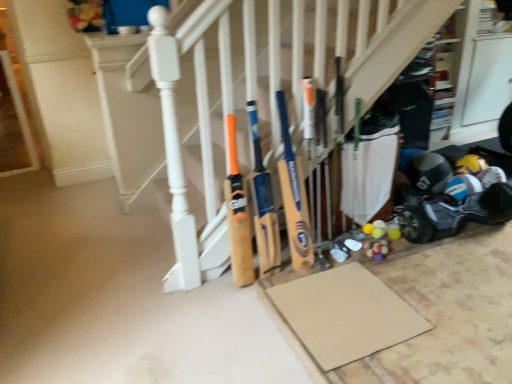
Measure the distance between yellow wood bat at center, which is the second baseball bat from left to right, and camera.

A distance of 1.83 meters exists between yellow wood bat at center, which is the second baseball bat from left to right, and camera.

What do you see at coordinates (327, 54) in the screenshot? Image resolution: width=512 pixels, height=384 pixels. I see `wooden bats at center` at bounding box center [327, 54].

Locate an element on the screen. wooden bats at center is located at coordinates (327, 54).

Find the location of a particular element. yellow wood bat at center, which is the second baseball bat from left to right is located at coordinates (294, 197).

Who is shorter, yellow wood bat at center, which is the second baseball bat from left to right, or wooden bat at center, the 1th baseball bat from the left?

With less height is wooden bat at center, the 1th baseball bat from the left.

Could you tell me if yellow wood bat at center, which is the 1th baseball bat from right to left, is turned towards wooden bat at center, the 1th baseball bat from the left?

No, yellow wood bat at center, which is the 1th baseball bat from right to left, is not turned towards wooden bat at center, the 1th baseball bat from the left.

Consider the image. Which object is positioned more to the left, yellow wood bat at center, which is the 1th baseball bat from right to left, or wooden bat at center, the second baseball bat positioned from the right?

wooden bat at center, the second baseball bat positioned from the right.

Which of these two, yellow wood bat at center, which is the 1th baseball bat from right to left, or wooden bat at center, the 1th baseball bat from the left, is smaller?

wooden bat at center, the 1th baseball bat from the left, is smaller.

Is blue plastic baby carriage at lower right inside or outside of wooden bats at center?

blue plastic baby carriage at lower right lies outside wooden bats at center.

Does blue plastic baby carriage at lower right have a greater height compared to wooden bats at center?

In fact, blue plastic baby carriage at lower right may be shorter than wooden bats at center.

Looking at this image, can you confirm if blue plastic baby carriage at lower right is bigger than wooden bats at center?

Incorrect, blue plastic baby carriage at lower right is not larger than wooden bats at center.

Which is in front, point (419, 204) or point (179, 241)?

The point (179, 241) is in front.

Is wooden bats at center positioned far away from blue plastic baby carriage at lower right?

wooden bats at center is positioned a significant distance from blue plastic baby carriage at lower right.

In terms of size, does wooden bats at center appear bigger or smaller than blue plastic baby carriage at lower right?

wooden bats at center is bigger than blue plastic baby carriage at lower right.

Between wooden bats at center and blue plastic baby carriage at lower right, which one has less height?

With less height is blue plastic baby carriage at lower right.

From the image's perspective, is wooden bats at center over blue plastic baby carriage at lower right?

Yes, from the image's perspective, wooden bats at center is above blue plastic baby carriage at lower right.

Is blue plastic baby carriage at lower right at the right side of wooden bat at center, the 1th baseball bat from the left?

Correct, you'll find blue plastic baby carriage at lower right to the right of wooden bat at center, the 1th baseball bat from the left.

How far apart are blue plastic baby carriage at lower right and wooden bat at center, the 1th baseball bat from the left?

blue plastic baby carriage at lower right is 3.85 feet from wooden bat at center, the 1th baseball bat from the left.

In terms of width, does blue plastic baby carriage at lower right look wider or thinner when compared to wooden bat at center, the second baseball bat positioned from the right?

Considering their sizes, blue plastic baby carriage at lower right looks broader than wooden bat at center, the second baseball bat positioned from the right.

From the image's perspective, which baseball bat is the 1st one above the blue plastic baby carriage at lower right? Please provide its 2D coordinates.

[(237, 213)]

The width and height of the screenshot is (512, 384). Identify the location of helmet beneath the wooden bat at center, the 1th baseball bat from the left (from a real-world perspective). (429, 173).

Is wooden bat at center, the 1th baseball bat from the left, thinner than matte black helmet at lower right?

Yes, wooden bat at center, the 1th baseball bat from the left, is thinner than matte black helmet at lower right.

Consider the image. Can you confirm if wooden bat at center, the second baseball bat positioned from the right, is smaller than matte black helmet at lower right?

No, wooden bat at center, the second baseball bat positioned from the right, is not smaller than matte black helmet at lower right.

Looking at this image, which is nearer, (x=228, y=224) or (x=428, y=170)?

Point (x=228, y=224) is closer to the camera than point (x=428, y=170).

Does matte black helmet at lower right have a larger size compared to blue plastic baby carriage at lower right?

No.

Is matte black helmet at lower right directly adjacent to blue plastic baby carriage at lower right?

No, matte black helmet at lower right is not making contact with blue plastic baby carriage at lower right.

Considering the sizes of objects matte black helmet at lower right and blue plastic baby carriage at lower right in the image provided, who is taller, matte black helmet at lower right or blue plastic baby carriage at lower right?

blue plastic baby carriage at lower right.

From the image's perspective, is matte black helmet at lower right on blue plastic baby carriage at lower right?

Yes, from the image's perspective, matte black helmet at lower right is over blue plastic baby carriage at lower right.

Is wooden bats at center in contact with yellow wood bat at center, which is the 1th baseball bat from right to left?

No, wooden bats at center is not with yellow wood bat at center, which is the 1th baseball bat from right to left.

Which object is positioned more to the right, wooden bats at center or yellow wood bat at center, which is the 1th baseball bat from right to left?

wooden bats at center is more to the right.

Consider the image. How far apart are wooden bats at center and yellow wood bat at center, which is the 1th baseball bat from right to left?

wooden bats at center is 15.46 inches away from yellow wood bat at center, which is the 1th baseball bat from right to left.

Do you think wooden bats at center is within yellow wood bat at center, which is the second baseball bat from left to right, or outside of it?

wooden bats at center is outside yellow wood bat at center, which is the second baseball bat from left to right.

Where is `baseball bat that is in front of the yellow wood bat at center, which is the second baseball bat from left to right`? This screenshot has height=384, width=512. baseball bat that is in front of the yellow wood bat at center, which is the second baseball bat from left to right is located at coordinates (237, 213).

Find the location of a particular element. This screenshot has width=512, height=384. baby carriage below the wooden bats at center (from a real-world perspective) is located at coordinates (448, 200).

Estimate the real-world distances between objects in this image. Which object is further from wooden bat at center, the second baseball bat positioned from the right, wooden bats at center or matte black helmet at lower right?

matte black helmet at lower right.

Considering their positions, is wooden bats at center positioned closer to wooden bat at center, the second baseball bat positioned from the right, than yellow wood bat at center, which is the second baseball bat from left to right?

yellow wood bat at center, which is the second baseball bat from left to right, lies closer to wooden bat at center, the second baseball bat positioned from the right, than the other object.

From the picture: Looking at the image, which one is located closer to wooden bat at center, the second baseball bat positioned from the right, matte black helmet at lower right or yellow wood bat at center, which is the 1th baseball bat from right to left?

Based on the image, yellow wood bat at center, which is the 1th baseball bat from right to left, appears to be nearer to wooden bat at center, the second baseball bat positioned from the right.

Considering their positions, is blue plastic baby carriage at lower right positioned further to wooden bat at center, the second baseball bat positioned from the right, than wooden bats at center?

The object further to wooden bat at center, the second baseball bat positioned from the right, is blue plastic baby carriage at lower right.

When comparing their distances from wooden bats at center, does yellow wood bat at center, which is the 1th baseball bat from right to left, or blue plastic baby carriage at lower right seem further?

blue plastic baby carriage at lower right.

Looking at the image, which one is located further to matte black helmet at lower right, wooden bats at center or yellow wood bat at center, which is the 1th baseball bat from right to left?

wooden bats at center.

Looking at the image, which one is located closer to wooden bats at center, matte black helmet at lower right or wooden bat at center, the second baseball bat positioned from the right?

The object closer to wooden bats at center is wooden bat at center, the second baseball bat positioned from the right.

Looking at the image, which one is located further to yellow wood bat at center, which is the second baseball bat from left to right, blue plastic baby carriage at lower right or wooden bats at center?

blue plastic baby carriage at lower right is positioned further to the anchor yellow wood bat at center, which is the second baseball bat from left to right.

Locate an element on the screen. Image resolution: width=512 pixels, height=384 pixels. baseball bat located between wooden bat at center, the second baseball bat positioned from the right, and blue plastic baby carriage at lower right in the left-right direction is located at coordinates (294, 197).

I want to click on baseball bat between wooden bat at center, the 1th baseball bat from the left, and wooden bats at center from left to right, so click(294, 197).

Where is `baby carriage between yellow wood bat at center, which is the second baseball bat from left to right, and matte black helmet at lower right, in the horizontal direction`? The height and width of the screenshot is (384, 512). baby carriage between yellow wood bat at center, which is the second baseball bat from left to right, and matte black helmet at lower right, in the horizontal direction is located at coordinates (448, 200).

I want to click on baby carriage between wooden bats at center and matte black helmet at lower right along the z-axis, so click(x=448, y=200).